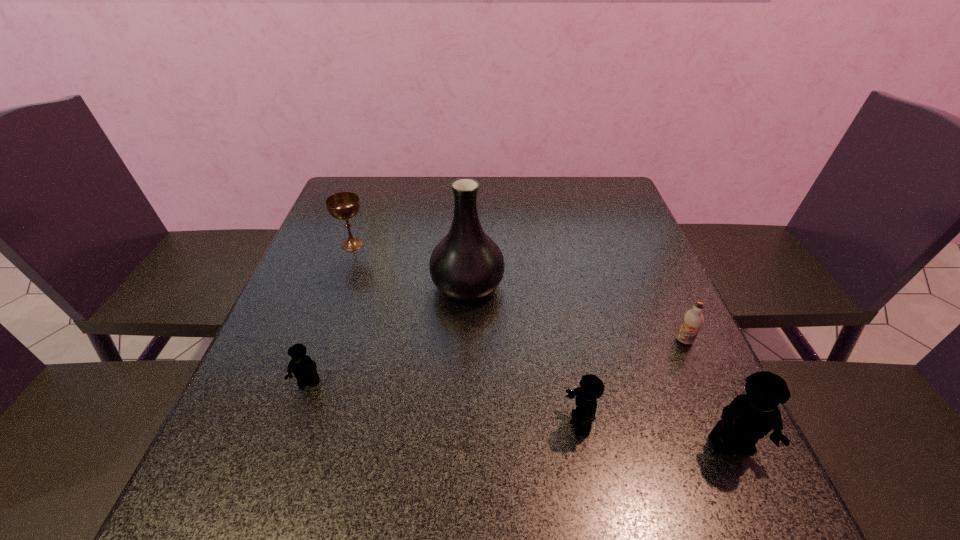
I want to click on Lego that can be found as the closest to the fifth nearest object, so click(304, 369).

Find the location of `Lego object that ranks as the second closest to the fourth object from left to right`. Lego object that ranks as the second closest to the fourth object from left to right is located at coordinates click(304, 369).

Find the location of a particular element. free space that satisfies the following two spatial constraints: 1. on the front side of the farthest object; 2. on the left side of the vase is located at coordinates (338, 285).